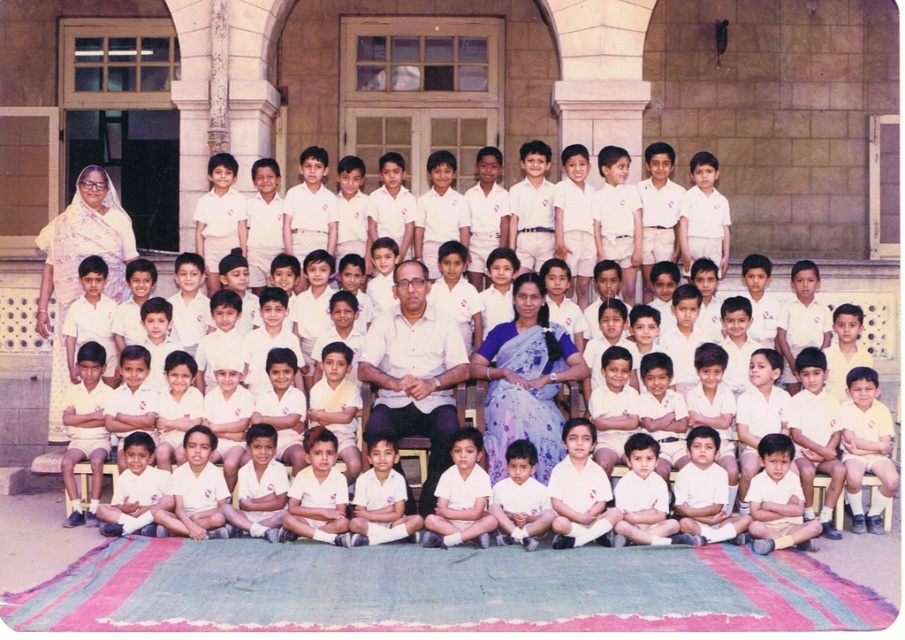
Does point (386, 385) come closer to viewer compared to point (82, 212)?

Yes, point (386, 385) is in front of point (82, 212).

Which is below, white matte shirt at center or white printed saree at upper left?

white matte shirt at center

Does point (388, 346) come behind point (101, 221)?

No, (388, 346) is in front of (101, 221).

Locate an element on the screen. The image size is (905, 640). white matte shirt at center is located at coordinates (414, 372).

Does purple floral saree at center have a smaller size compared to white printed saree at upper left?

Yes.

Find the location of a particular element. purple floral saree at center is located at coordinates (525, 378).

Find the location of a particular element. The height and width of the screenshot is (640, 905). purple floral saree at center is located at coordinates (525, 378).

Which is in front, point (570, 358) or point (777, 280)?

Point (570, 358)

The height and width of the screenshot is (640, 905). Describe the element at coordinates (525, 378) in the screenshot. I see `purple floral saree at center` at that location.

The image size is (905, 640). I want to click on purple floral saree at center, so click(525, 378).